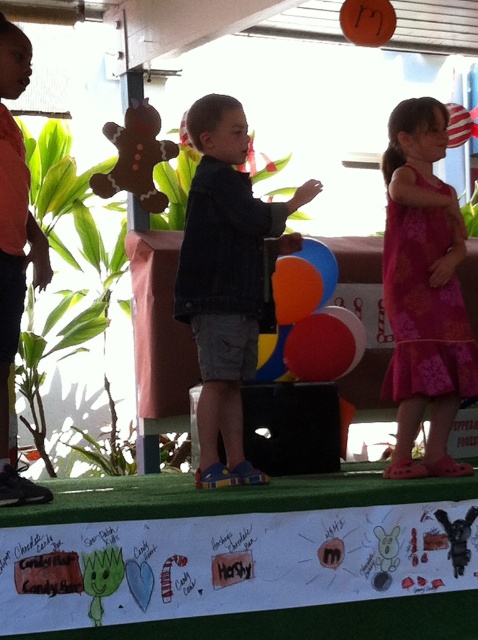
Question: Estimate the real-world distances between objects in this image. Which object is farther from the pink floral dress at right?

Choices:
 (A) felt gingerbread man at upper left
 (B) denim jacket at center

Answer: (A)

Question: Is pink floral dress at right bigger than felt gingerbread man at upper left?

Choices:
 (A) no
 (B) yes

Answer: (B)

Question: Is denim jacket at center wider than felt gingerbread man at upper left?

Choices:
 (A) no
 (B) yes

Answer: (B)

Question: Which point is closer to the camera?

Choices:
 (A) (438, 285)
 (B) (228, 336)
 (C) (109, 134)

Answer: (B)

Question: Considering the real-world distances, which object is closest to the felt gingerbread man at upper left?

Choices:
 (A) pink floral dress at right
 (B) denim jacket at center

Answer: (B)

Question: Can you confirm if denim jacket at center is bigger than felt gingerbread man at upper left?

Choices:
 (A) no
 (B) yes

Answer: (B)